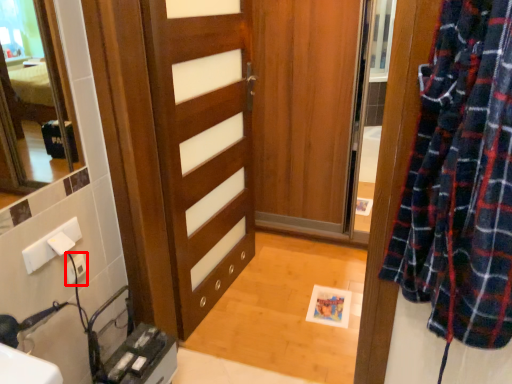
Question: From the image's perspective, what is the correct spatial positioning of electric outlet (annotated by the red box) in reference to door?

Choices:
 (A) above
 (B) below

Answer: (B)